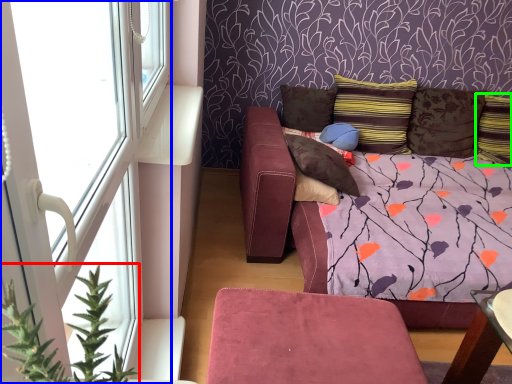
Question: Which object is positioned closest to plant (highlighted by a red box)? Select from window (highlighted by a blue box) and pillow (highlighted by a green box).

Choices:
 (A) window
 (B) pillow

Answer: (A)